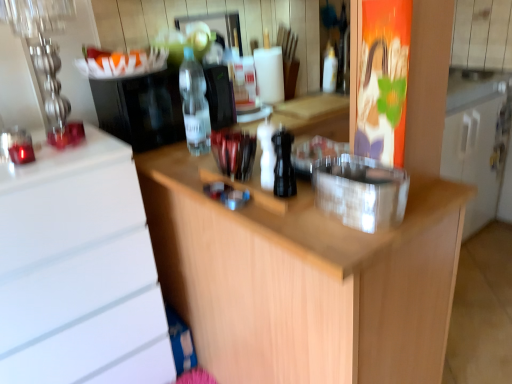
Where is `vacant space to the right of black matte pepper grinder at center, the second bottle viewed from the right`? The image size is (512, 384). vacant space to the right of black matte pepper grinder at center, the second bottle viewed from the right is located at coordinates (324, 193).